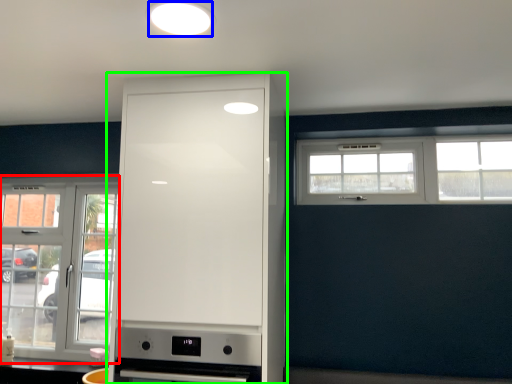
Question: Which is nearer to the window (highlighted by a red box)? lighting (highlighted by a blue box) or cabinetry (highlighted by a green box).

Choices:
 (A) lighting
 (B) cabinetry

Answer: (B)